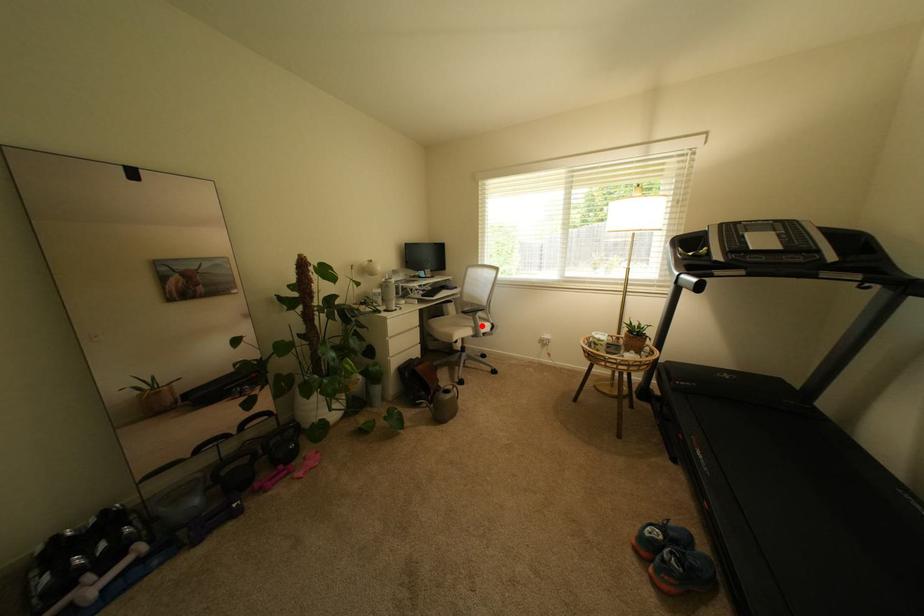
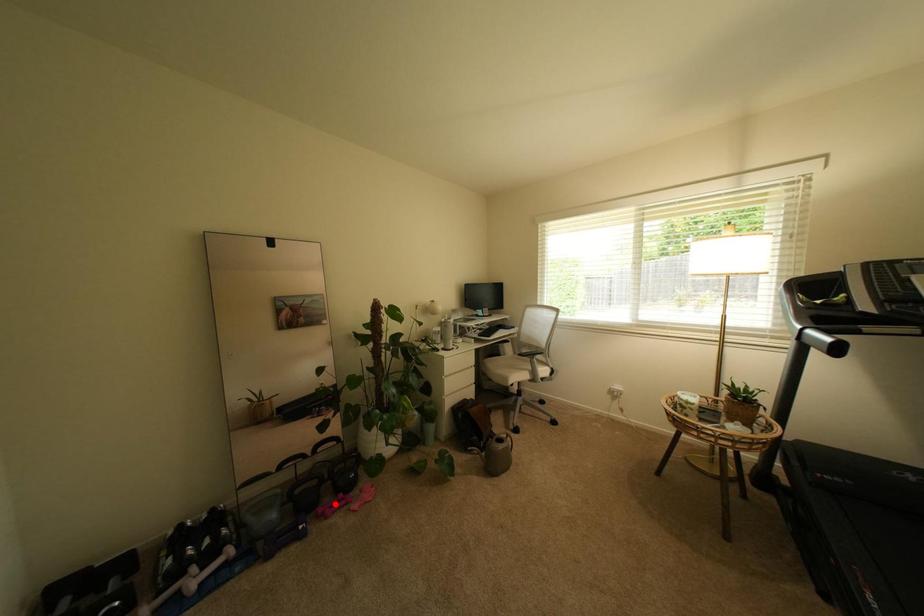
I am providing you with two images of the same scene from different viewpoints. A red point is marked on the first image and another point is marked on the second image. Is the marked point in image1 the same physical position as the marked point in image2?

No